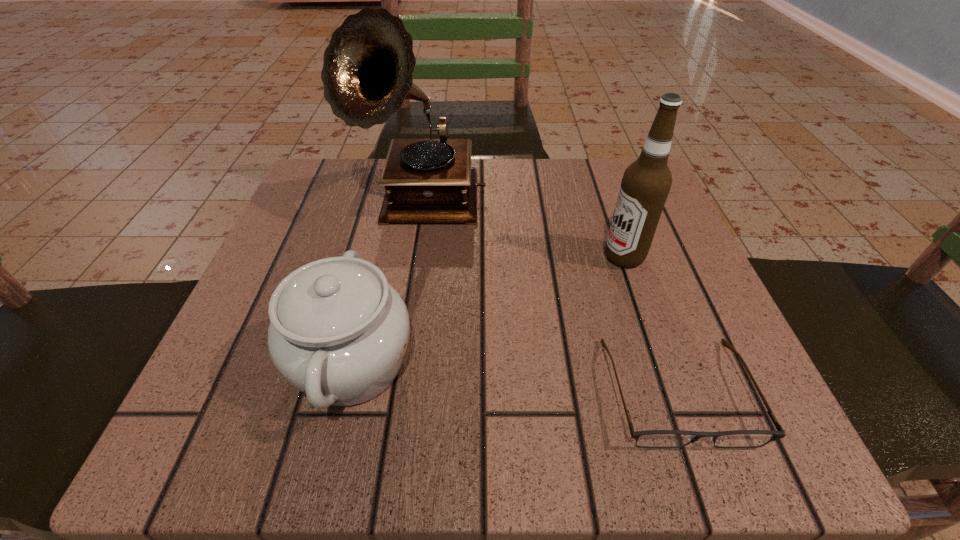
Where is `object present at the near right corner`? The width and height of the screenshot is (960, 540). object present at the near right corner is located at coordinates (651, 438).

Identify the location of vacant space at the far edge of the desktop. This screenshot has width=960, height=540. (482, 219).

This screenshot has height=540, width=960. I want to click on free spot at the near edge of the desktop, so click(x=485, y=449).

Where is `vacant area at the left edge`? vacant area at the left edge is located at coordinates (249, 307).

This screenshot has width=960, height=540. I want to click on vacant space at the right edge of the desktop, so click(x=677, y=239).

At what (x,y) coordinates should I click in order to perform the action: click on free space at the far left corner of the desktop. Please return your answer as a coordinate pair (x, y). Image resolution: width=960 pixels, height=540 pixels. Looking at the image, I should click on (327, 160).

Locate an element on the screen. free space at the near left corner is located at coordinates (307, 434).

Where is `vacant space at the far right corner`? vacant space at the far right corner is located at coordinates (604, 197).

In the image, there is a desktop. Identify the location of vacant space at the near right corner. tap(684, 456).

This screenshot has width=960, height=540. Identify the location of free space between the second shortest object and the third nearest object. (488, 310).